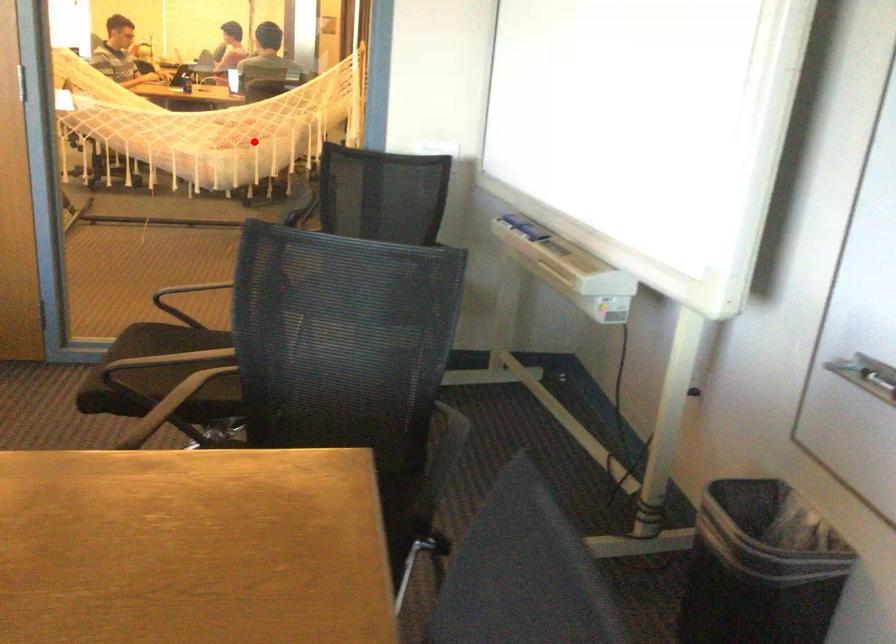
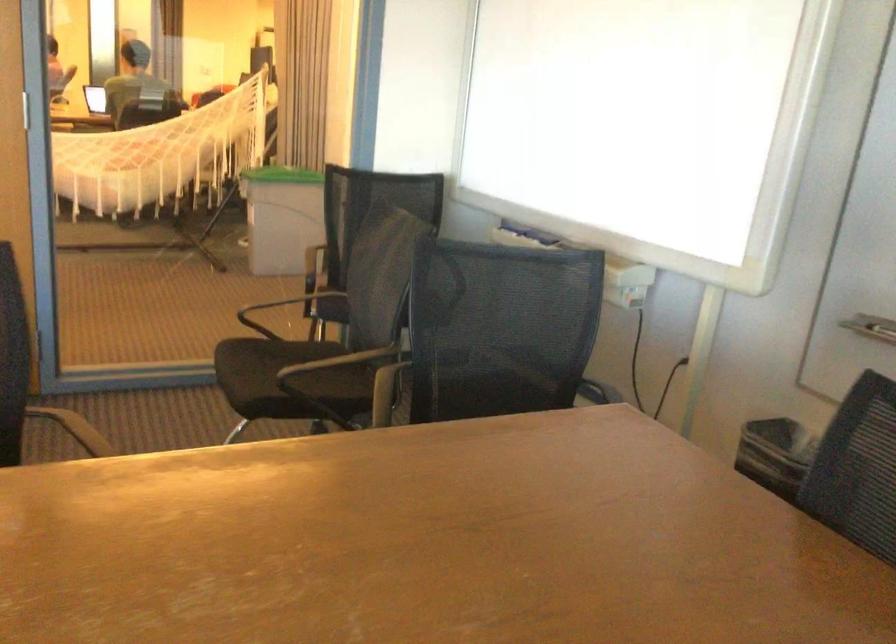
In the second image, find the point that corresponds to the highlighted location in the first image.

(161, 156)